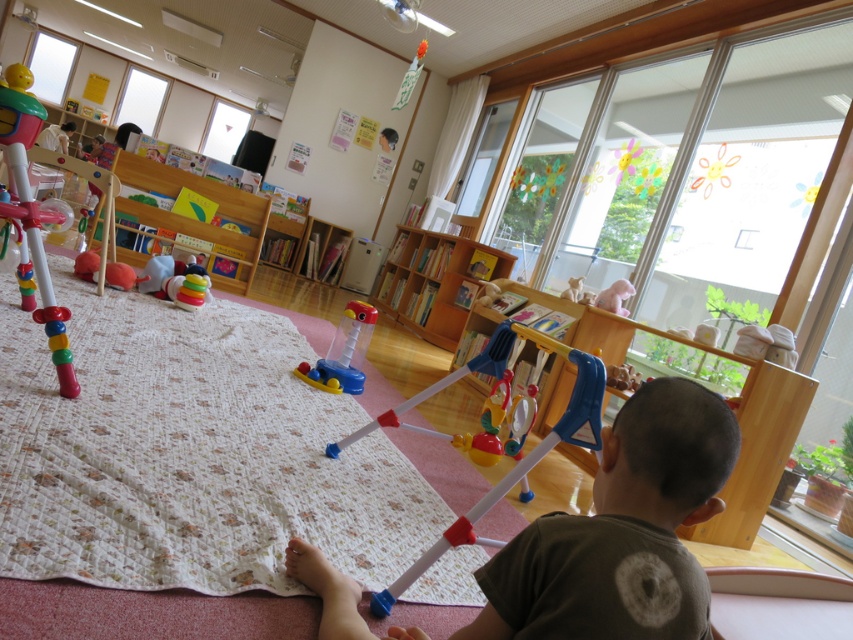
Question: Which is farther from the multicolored plastic toy at left?

Choices:
 (A) translucent plastic toy at center
 (B) dark green cotton shirt at lower center

Answer: (B)

Question: Is dark green cotton shirt at lower center to the left of translucent plastic toy at center from the viewer's perspective?

Choices:
 (A) yes
 (B) no

Answer: (B)

Question: Among these points, which one is nearest to the camera?

Choices:
 (A) (303, 376)
 (B) (30, 211)
 (C) (711, 508)

Answer: (C)

Question: In this image, where is multicolored plastic toy at left located relative to translucent plastic toy at center?

Choices:
 (A) right
 (B) left

Answer: (B)

Question: Is dark green cotton shirt at lower center positioned before translucent plastic toy at center?

Choices:
 (A) no
 (B) yes

Answer: (B)

Question: Which object appears farthest from the camera in this image?

Choices:
 (A) multicolored plastic toy at left
 (B) translucent plastic toy at center

Answer: (B)